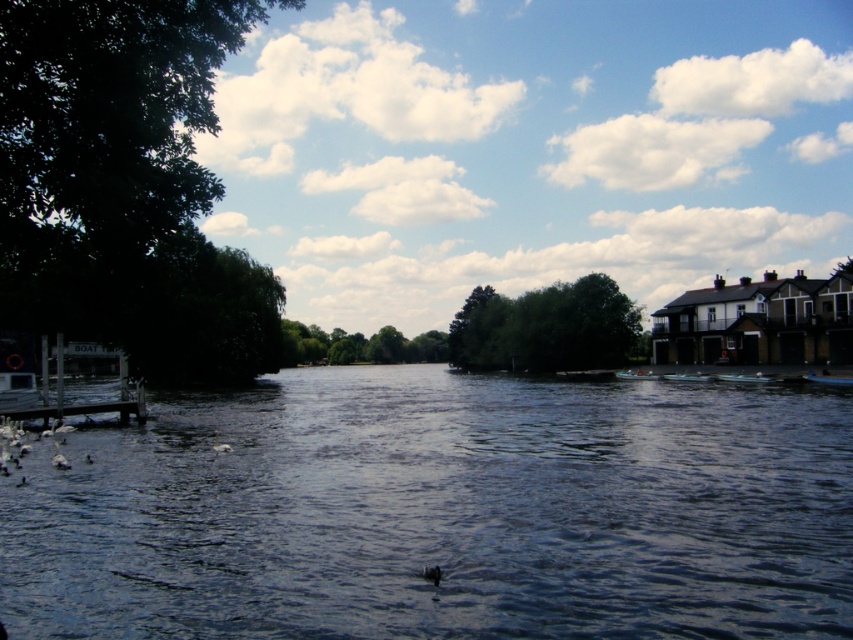
Question: Is wooden dock at left further to the viewer compared to white plastic boat at center-right?

Choices:
 (A) yes
 (B) no

Answer: (B)

Question: Can you confirm if dark blue water at center is bigger than blue plastic boat at right?

Choices:
 (A) no
 (B) yes

Answer: (B)

Question: Which point is farther to the camera?

Choices:
 (A) white plastic boat at center
 (B) white feathered bird at center

Answer: (A)

Question: Does white plastic boat at center-right appear over white plastic boat at center?

Choices:
 (A) yes
 (B) no

Answer: (A)

Question: Which point is closer to the camera?

Choices:
 (A) (662, 374)
 (B) (846, 376)
 (C) (625, 374)

Answer: (B)

Question: Which point is closer to the camera taking this photo?

Choices:
 (A) (756, 376)
 (B) (840, 376)

Answer: (B)